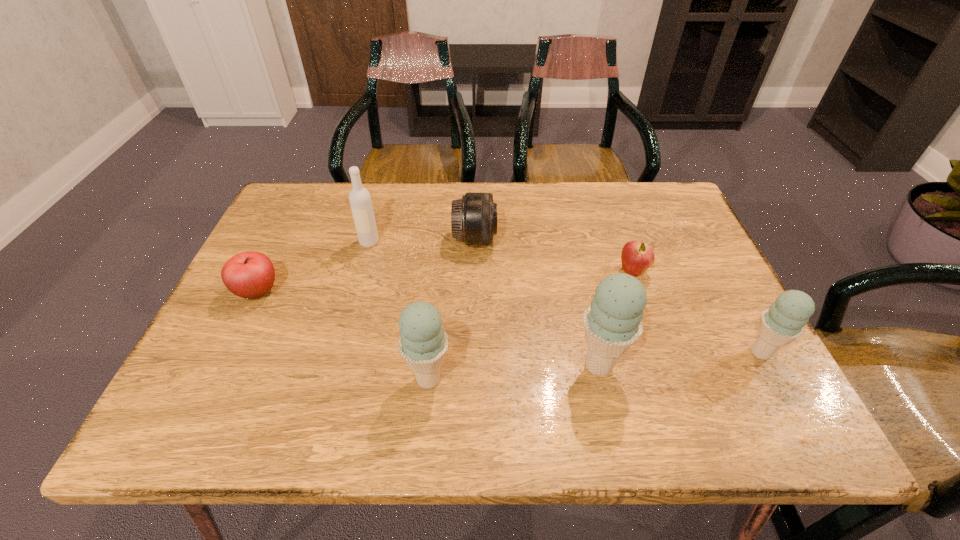
Find the location of `vacant space at the near edge`. vacant space at the near edge is located at coordinates (533, 380).

In the image, there is a desktop. Identify the location of vacant space at the left edge. (277, 240).

Locate an element on the screen. vacant space at the right edge of the desktop is located at coordinates (690, 328).

Image resolution: width=960 pixels, height=540 pixels. I want to click on free spot at the near left corner of the desktop, so click(270, 356).

At what (x,y) coordinates should I click in order to perform the action: click on free space at the far right corner of the desktop. Please return your answer as a coordinate pair (x, y). This screenshot has height=540, width=960. Looking at the image, I should click on (665, 201).

Image resolution: width=960 pixels, height=540 pixels. I want to click on vacant area that lies between the rightmost object and the leftmost object, so click(x=509, y=322).

I want to click on vacant area that lies between the telephoto lens and the leftmost object, so click(366, 265).

Locate an element on the screen. The height and width of the screenshot is (540, 960). free space between the leftmost object and the fifth tallest object is located at coordinates (366, 265).

Identify the location of free area in between the telephoto lens and the leftmost object. This screenshot has width=960, height=540. (366, 265).

Where is `unoccupied area between the rightmost ice cream and the second ice cream from right to left`? unoccupied area between the rightmost ice cream and the second ice cream from right to left is located at coordinates (680, 359).